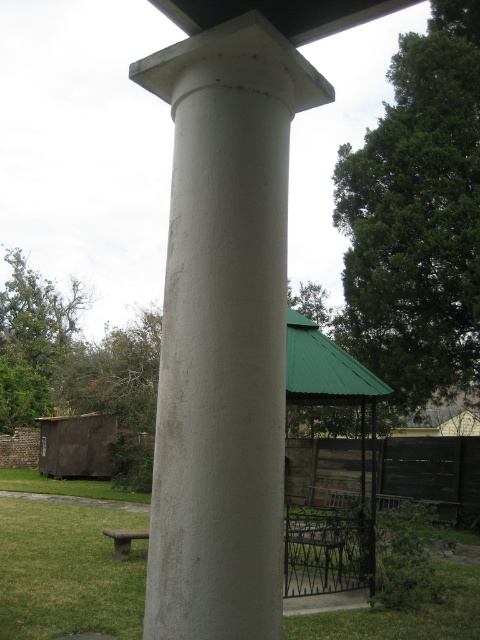
You are a landscape architect designing a garden. You need to place a new statue that requires a base larger than the green grass at lower left. Can the white smooth column at center provide a suitable base for this statue?

The white smooth column at center has a smaller size compared to green grass at lower left, so it cannot provide a suitable base for the statue since its size is insufficient.